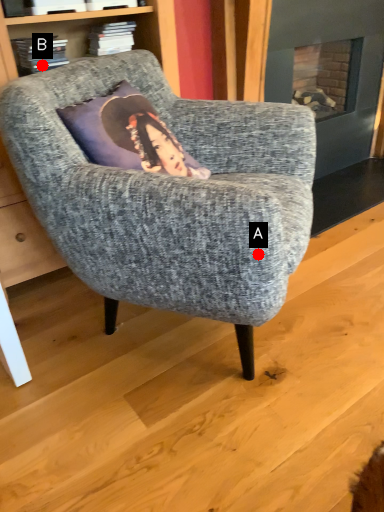
Question: Two points are circled on the image, labeled by A and B beside each circle. Which point appears closest to the camera in this image?

Choices:
 (A) A is closer
 (B) B is closer

Answer: (A)